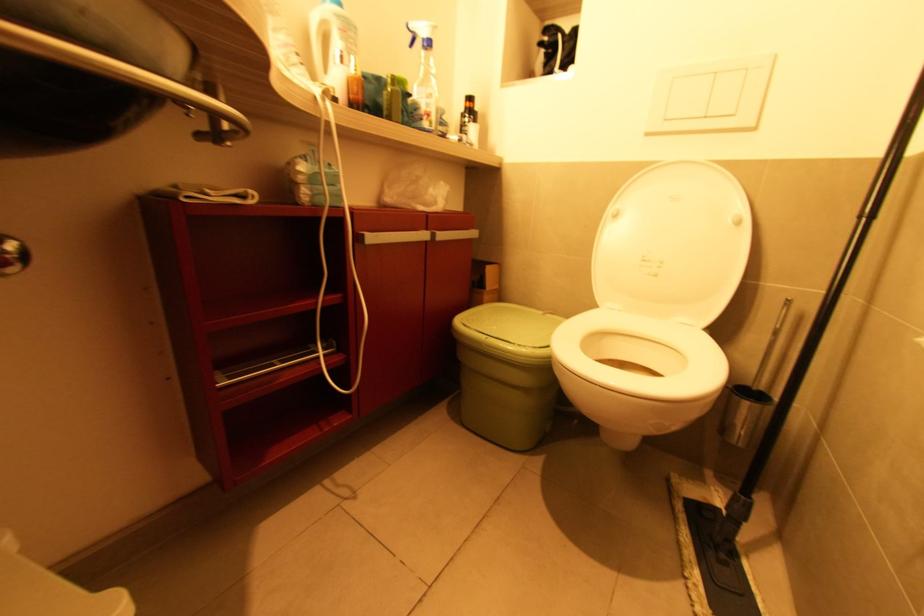
The image size is (924, 616). Describe the element at coordinates (640, 354) in the screenshot. I see `the white toilet seat` at that location.